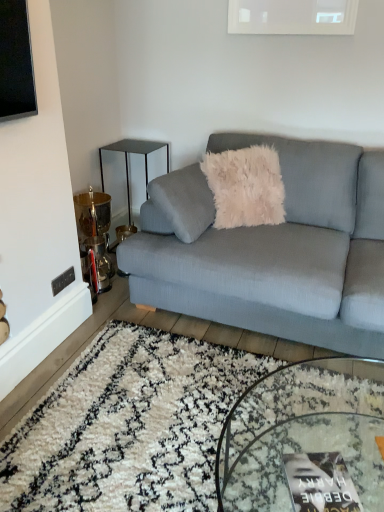
Where is `free space to the back side of matte black magazine at lower center`? The image size is (384, 512). free space to the back side of matte black magazine at lower center is located at coordinates (321, 451).